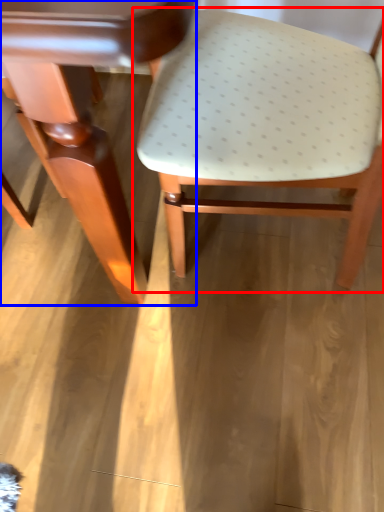
Question: Which of the following is the farthest to the observer, chair (highlighted by a red box) or table (highlighted by a blue box)?

Choices:
 (A) chair
 (B) table

Answer: (A)